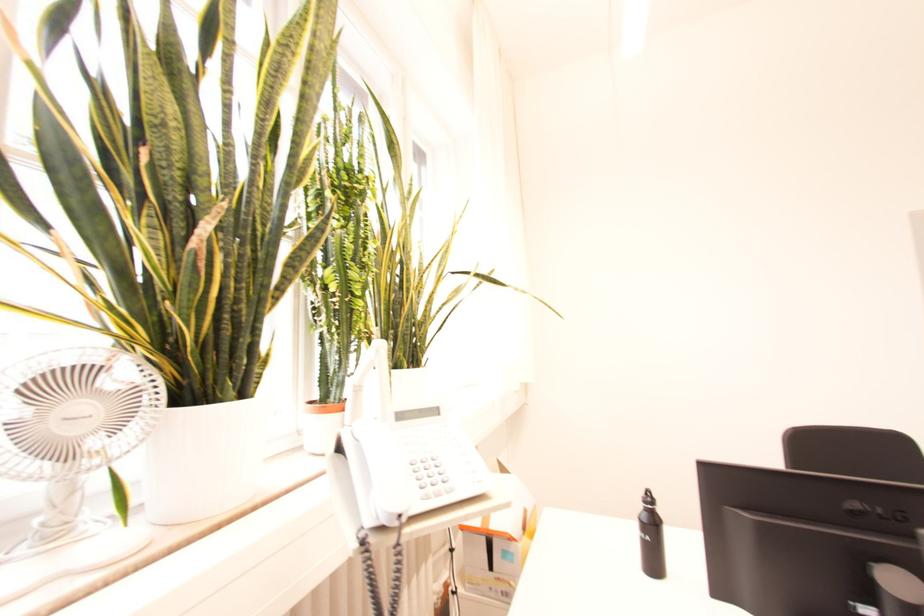
The width and height of the screenshot is (924, 616). Describe the element at coordinates (430, 474) in the screenshot. I see `a telephone keypad button` at that location.